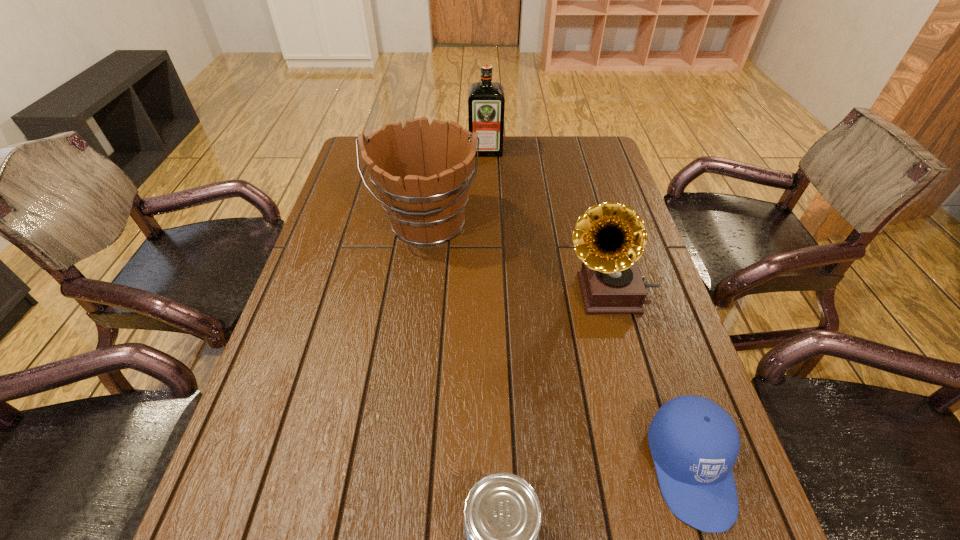
At what (x,y) coordinates should I click in order to perform the action: click on object at the near edge. Please return your answer as a coordinate pair (x, y). This screenshot has width=960, height=540. Looking at the image, I should click on (694, 443).

Locate an element on the screen. The height and width of the screenshot is (540, 960). object that is positioned at the left edge is located at coordinates (422, 174).

Where is `phonograph record situated at the right edge`? The width and height of the screenshot is (960, 540). phonograph record situated at the right edge is located at coordinates (609, 238).

This screenshot has width=960, height=540. What are the coordinates of `cap at the right edge` in the screenshot? It's located at (694, 443).

Identify the location of object present at the near right corner. tap(694, 443).

The height and width of the screenshot is (540, 960). In the image, there is a desktop. Identify the location of free region at the far edge. (544, 152).

Identify the location of vacant space at the left edge of the desktop. (357, 199).

Find the location of a particular element. This screenshot has height=540, width=960. vacant space at the right edge is located at coordinates (604, 315).

I want to click on vacant space that's between the cap and the third farthest object, so click(x=650, y=380).

Locate an element on the screen. This screenshot has height=540, width=960. vacant area that lies between the fourth nearest object and the phonograph record is located at coordinates (517, 258).